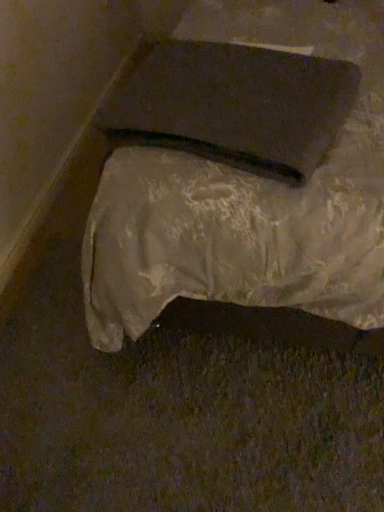
Describe the element at coordinates (230, 190) in the screenshot. I see `white fabric-covered object at center` at that location.

Measure the distance between point (245, 240) and camera.

Point (245, 240) and camera are 33.27 inches apart.

In order to face white fabric-covered object at center, should I rotate leftwards or rightwards?

It's best to rotate right around 11.213 degrees.

Where is `white fabric-covered object at center`? The width and height of the screenshot is (384, 512). white fabric-covered object at center is located at coordinates (230, 190).

Find the location of `matte black pad at upper center`. matte black pad at upper center is located at coordinates (231, 105).

What do you see at coordinates (231, 105) in the screenshot? I see `matte black pad at upper center` at bounding box center [231, 105].

In order to click on white fabric-covered object at center in this screenshot , I will do `click(230, 190)`.

Considering the positions of objects matte black pad at upper center and white fabric-covered object at center in the image provided, who is more to the left, matte black pad at upper center or white fabric-covered object at center?

matte black pad at upper center.

Relative to white fabric-covered object at center, is matte black pad at upper center in front or behind?

In the image, matte black pad at upper center appears behind white fabric-covered object at center.

Which point is more forward, (195, 139) or (100, 242)?

The point (195, 139) is more forward.

From the image's perspective, is matte black pad at upper center below white fabric-covered object at center?

Indeed, from the image's perspective, matte black pad at upper center is shown beneath white fabric-covered object at center.

From a real-world perspective, which object stands above the other?

In real-world perspective, matte black pad at upper center is above.

Does matte black pad at upper center have a greater width compared to white fabric-covered object at center?

No.

Can you confirm if matte black pad at upper center is taller than white fabric-covered object at center?

No.

Looking at the image, does matte black pad at upper center seem bigger or smaller compared to white fabric-covered object at center?

matte black pad at upper center is smaller than white fabric-covered object at center.

Does matte black pad at upper center contain white fabric-covered object at center?

That's incorrect, white fabric-covered object at center is not inside matte black pad at upper center.

Is matte black pad at upper center in contact with white fabric-covered object at center?

Yes, matte black pad at upper center is right next to white fabric-covered object at center and making contact.

Is matte black pad at upper center facing towards white fabric-covered object at center?

Yes, matte black pad at upper center is oriented towards white fabric-covered object at center.

How many degrees apart are the facing directions of matte black pad at upper center and white fabric-covered object at center?

The facing directions of matte black pad at upper center and white fabric-covered object at center are 17.1 degrees apart.

You are a GUI agent. You are given a task and a screenshot of the screen. Output one action in this format:
    pyautogui.click(x=<x>, y=<y>)
    Task: Click on the furniture in front of the matte black pad at upper center
    
    Given the screenshot: What is the action you would take?
    pyautogui.click(x=230, y=190)

Which object is positioned more to the left, white fabric-covered object at center or matte black pad at upper center?

From the viewer's perspective, matte black pad at upper center appears more on the left side.

Considering the relative positions of white fabric-covered object at center and matte black pad at upper center in the image provided, is white fabric-covered object at center behind matte black pad at upper center?

No, white fabric-covered object at center is closer to the camera.

Does point (151, 240) lie behind point (149, 134)?

No, it is not.

From the image's perspective, is white fabric-covered object at center located above matte black pad at upper center?

Indeed, from the image's perspective, white fabric-covered object at center is shown above matte black pad at upper center.

From a real-world perspective, which is physically below, white fabric-covered object at center or matte black pad at upper center?

white fabric-covered object at center.

Is white fabric-covered object at center wider than matte black pad at upper center?

Yes, white fabric-covered object at center is wider than matte black pad at upper center.

Considering the sizes of white fabric-covered object at center and matte black pad at upper center in the image, is white fabric-covered object at center taller or shorter than matte black pad at upper center?

white fabric-covered object at center is taller than matte black pad at upper center.

Considering the sizes of objects white fabric-covered object at center and matte black pad at upper center in the image provided, who is smaller, white fabric-covered object at center or matte black pad at upper center?

matte black pad at upper center.

Is white fabric-covered object at center not inside matte black pad at upper center?

white fabric-covered object at center is positioned outside matte black pad at upper center.

Is white fabric-covered object at center next to matte black pad at upper center and touching it?

Yes, white fabric-covered object at center is in contact with matte black pad at upper center.

Looking at this image, is white fabric-covered object at center facing towards matte black pad at upper center?

Yes, white fabric-covered object at center is turned towards matte black pad at upper center.

Based on the photo, how different are the orientations of white fabric-covered object at center and matte black pad at upper center in degrees?

The angular difference between white fabric-covered object at center and matte black pad at upper center is 17.1 degrees.

This screenshot has width=384, height=512. Find the location of `furniture below the matte black pad at upper center (from a real-world perspective)`. furniture below the matte black pad at upper center (from a real-world perspective) is located at coordinates (230, 190).

Identify the location of furniture to the right of matte black pad at upper center. Image resolution: width=384 pixels, height=512 pixels. (230, 190).

Where is `pad below the white fabric-covered object at center (from the image's perspective)`? This screenshot has width=384, height=512. pad below the white fabric-covered object at center (from the image's perspective) is located at coordinates (231, 105).